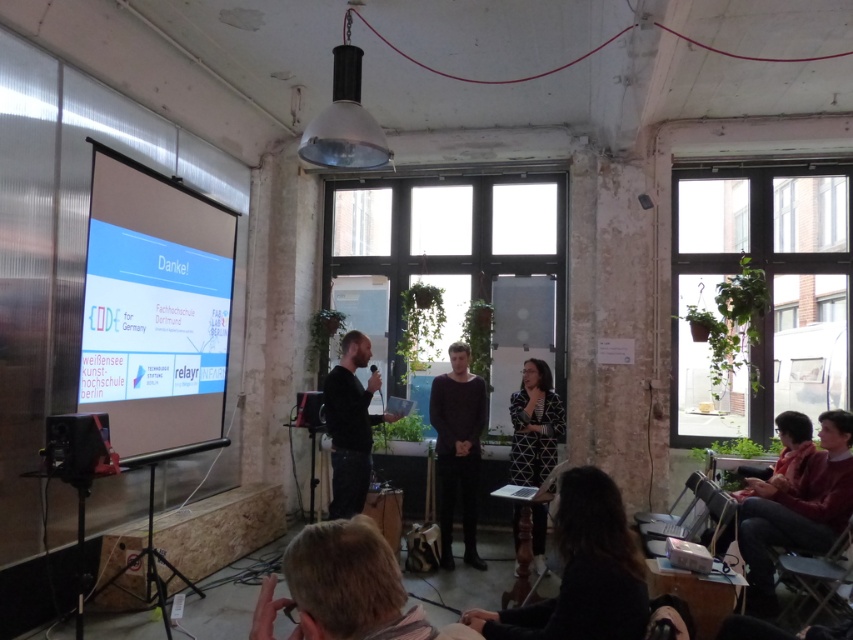
You are organizing a photo shoot and need to ensure that the blonde hair at lower center and the dark red sweater at lower right are both visible in the frame. Given that the camera has a fixed focal length, which object should you focus on to ensure both are in focus?

To ensure both the blonde hair at lower center and the dark red sweater at lower right are in focus, focus on the dark red sweater at lower right since it is wider and has a larger depth of field requirement.

You are standing in the room and want to pick up the dark red sweater at lower right. What are the coordinates where you should look to find it?

The dark red sweater at lower right can be found at coordinates point [796,509].

You are organizing a photo shoot and need to ensure that the two central figures in the image are framed properly. Given that the black matte sweater at center and the black printed dress at center are both in the center, which clothing item requires a wider frame to accommodate its width?

The black matte sweater at center requires a wider frame because its width is larger than the black printed dress at center.